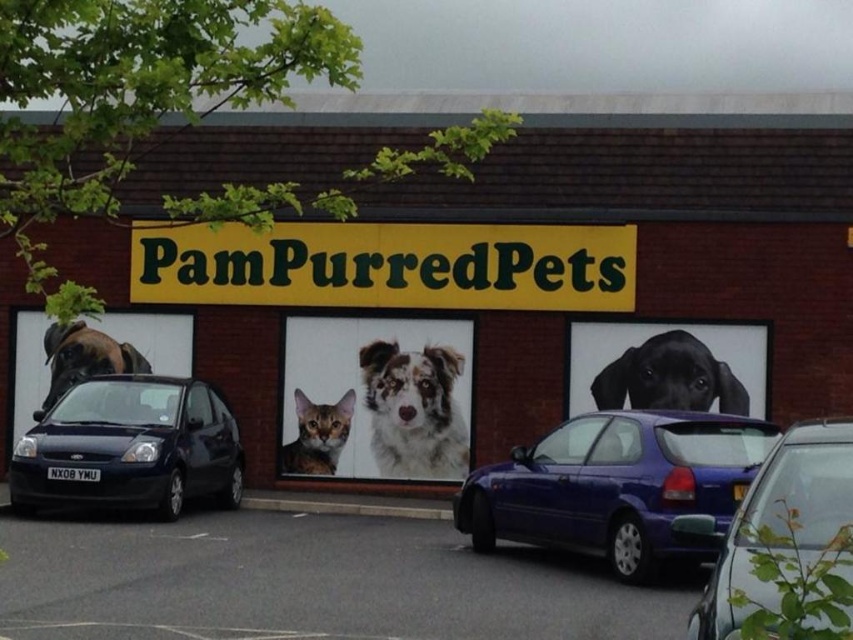
Between point (628, 468) and point (299, 440), which one is positioned behind?

Positioned behind is point (299, 440).

Can you confirm if metallic blue hatchback at center right is wider than fluffy white dog at center?

Yes.

Find the location of a particular element. The image size is (853, 640). metallic blue hatchback at center right is located at coordinates (618, 484).

Locate an element on the screen. metallic blue hatchback at center right is located at coordinates (618, 484).

Between white fur dog at center and black glossy dog at center, which one appears on the right side from the viewer's perspective?

From the viewer's perspective, black glossy dog at center appears more on the right side.

Between white fur dog at center and black glossy dog at center, which one is positioned lower?

Positioned lower is white fur dog at center.

Does point (422, 412) come farther from viewer compared to point (709, 369)?

Yes, point (422, 412) is behind point (709, 369).

Where is `white fur dog at center`? The width and height of the screenshot is (853, 640). white fur dog at center is located at coordinates (415, 410).

Between metallic blue hatchback at center right and black glossy dog at center, which one has more height?

metallic blue hatchback at center right is taller.

The image size is (853, 640). Describe the element at coordinates (618, 484) in the screenshot. I see `metallic blue hatchback at center right` at that location.

Where is `metallic blue hatchback at center right`? The image size is (853, 640). metallic blue hatchback at center right is located at coordinates (618, 484).